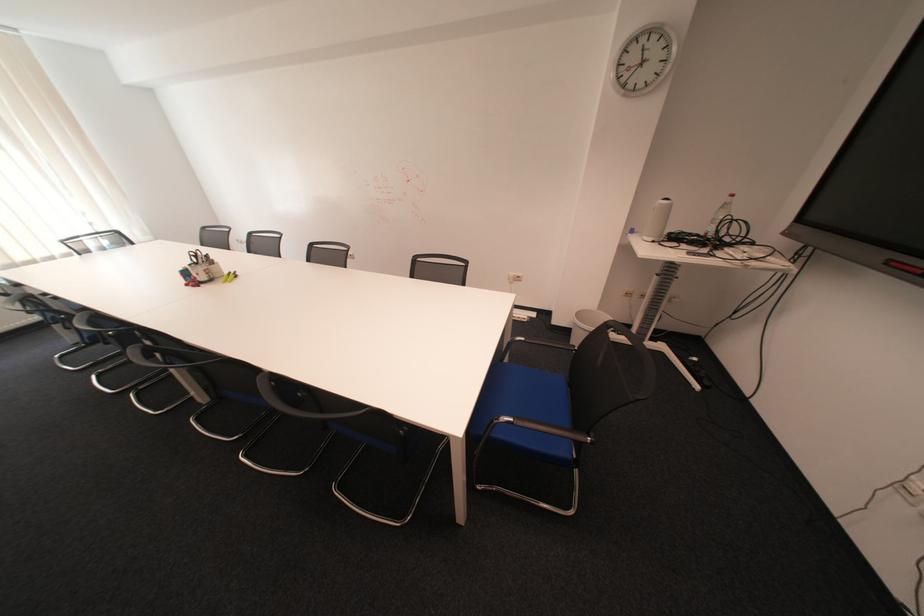
Which object does [586,323] point to?

It refers to a white trash can.